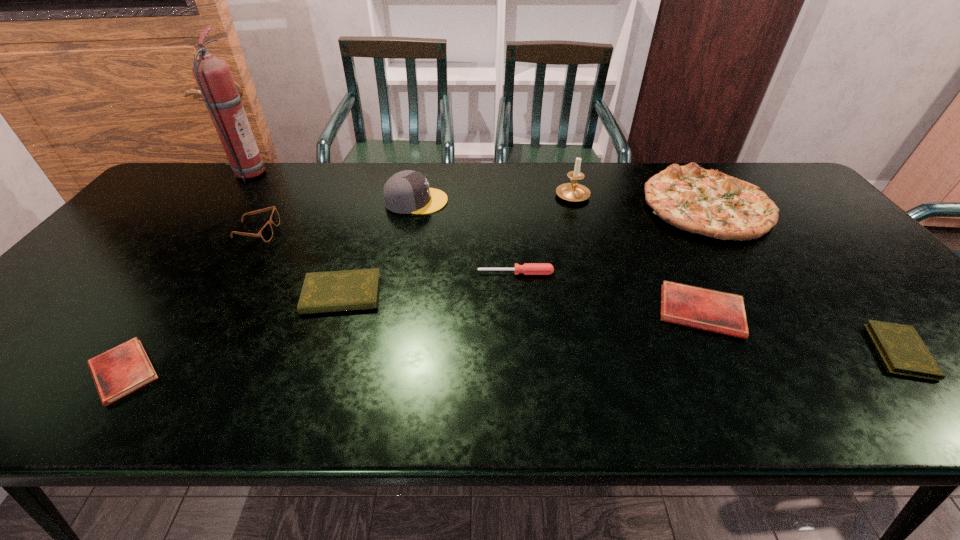
The height and width of the screenshot is (540, 960). Find the location of `free space in the image that satisfies the following two spatial constraints: 1. on the side of the fire extinguisher with the label and nozzle; 2. on the left side of the screwdriver`. free space in the image that satisfies the following two spatial constraints: 1. on the side of the fire extinguisher with the label and nozzle; 2. on the left side of the screwdriver is located at coordinates (173, 273).